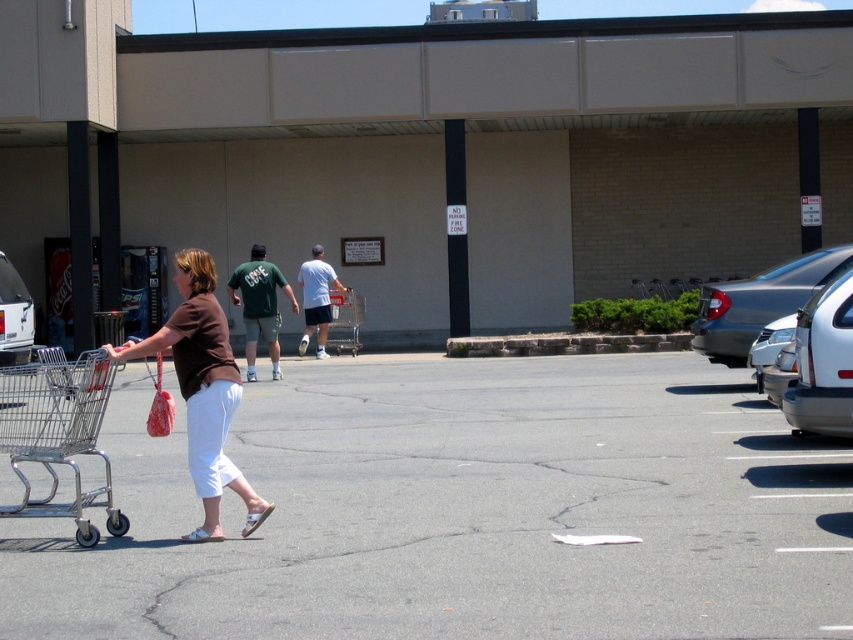
Based on the photo, you are standing at the entrance of the supermarket and see the brown fabric shirt at center and the white glossy car at center. If you want to reach the car first, which direction should you walk towards?

You should walk towards the white glossy car at center because the brown fabric shirt at center is 6.65 meters away from it, meaning the car is closer to your current position.

You are a delivery driver who needs to park your vehicle in the parking lot near the supermarket. You see a silver metallic sedan at right and a white glossy car at center. Which car is parked higher up in the parking lot?

The silver metallic sedan at right is parked higher up in the parking lot because it is positioned above the white glossy car at center.

You are a delivery person who needs to deliver a package to the woman wearing the brown fabric shirt at center. The package is too large to carry while pushing the shopping cart. Can you hand the package to her while she is walking towards the building, considering the size of her shirt compared to the white glossy car at center?

The brown fabric shirt at center has a larger size compared to the white glossy car at center. Since the shirt is larger, the woman has a broader upper body, making it easier to hand the package to her while she walks. However, ensure she can securely hold it without dropping the package.